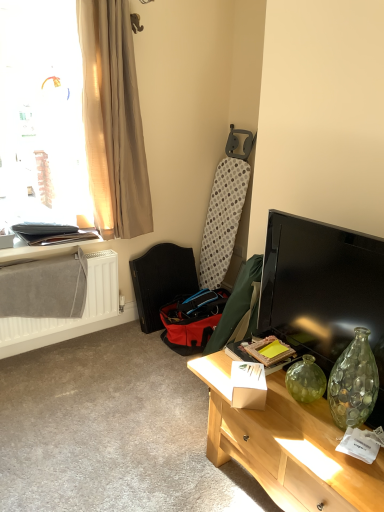
The image size is (384, 512). I want to click on vacant point above white textured radiator at left (from a real-world perspective), so click(63, 253).